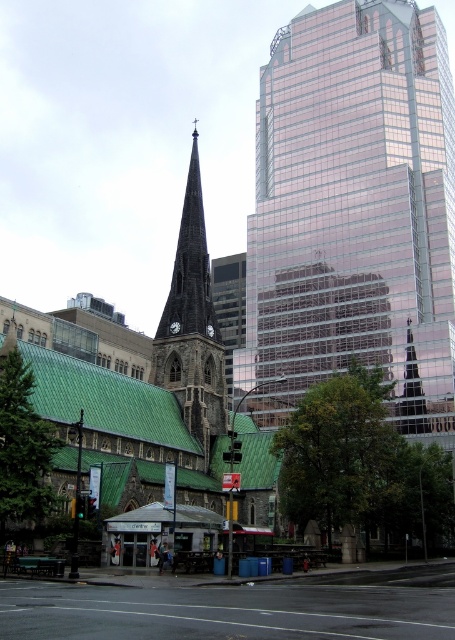
Question: Estimate the real-world distances between objects in this image. Which object is closer to the shiny glass spire at center?

Choices:
 (A) dark brown wooden spire at center
 (B) green slate roof at center

Answer: (A)

Question: Among these points, which one is nearest to the camera?

Choices:
 (A) (423, 388)
 (B) (191, 198)
 (C) (440, 52)

Answer: (B)

Question: Considering the real-world distances, which object is farthest from the glassy reflective skyscraper at center?

Choices:
 (A) dark brown wooden spire at center
 (B) shiny glass spire at center
 (C) green slate roof at center

Answer: (A)

Question: Is green slate roof at center below dark brown wooden spire at center?

Choices:
 (A) yes
 (B) no

Answer: (A)

Question: Does green slate roof at center have a larger size compared to dark brown wooden spire at center?

Choices:
 (A) yes
 (B) no

Answer: (A)

Question: Can you confirm if green slate roof at center is positioned to the right of shiny glass spire at center?

Choices:
 (A) yes
 (B) no

Answer: (B)